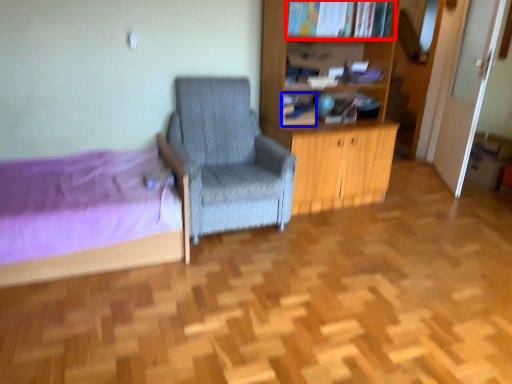
Question: Which of the following is the closest to the observer, book (highlighted by a red box) or book (highlighted by a blue box)?

Choices:
 (A) book
 (B) book

Answer: (A)